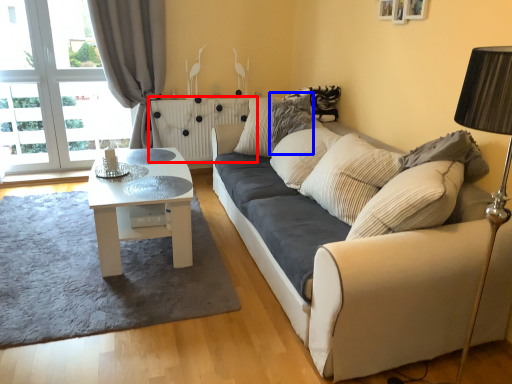
Question: Which object appears farthest to the camera in this image, radiator (highlighted by a red box) or pillow (highlighted by a blue box)?

Choices:
 (A) radiator
 (B) pillow

Answer: (A)